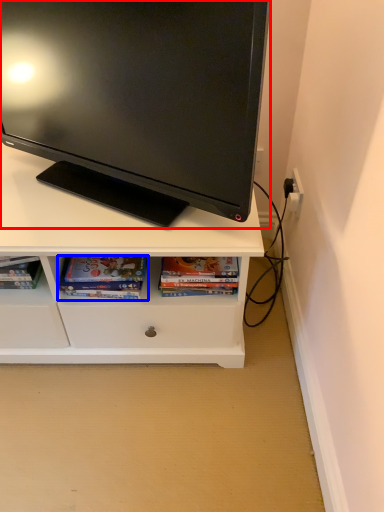
Question: Which point is further to the camera, television (highlighted by a red box) or book (highlighted by a blue box)?

Choices:
 (A) television
 (B) book

Answer: (B)